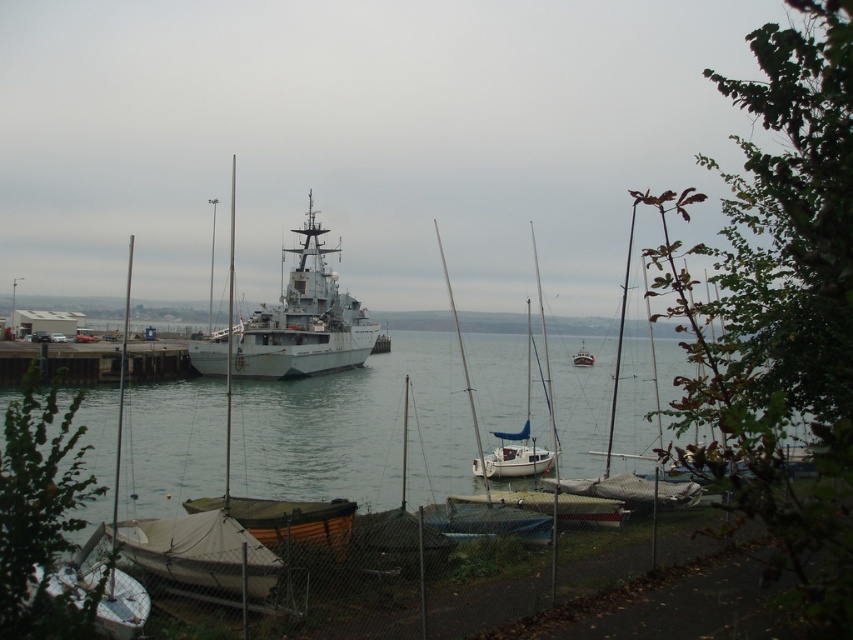
You are a harbor worker who needs to move a 100 meter long cargo ship into the harbor. The white canvas boat at lower left and the white matte sailboat at center are in the way. Can you move the cargo ship through the space between them?

The white canvas boat at lower left and white matte sailboat at center are 133.41 meters apart from each other. Since the cargo ship is 100 meters long, the space between them is sufficient for the ship to pass through.

You are a photographer positioned at the dock. You want to take a photo of the white canvas boat at lower left without the white matte ship at center blocking the view. Is this possible given their positions?

The white canvas boat at lower left is behind the white matte ship at center, so it is currently blocked by the ship. To take a photo without the ship blocking the view, you would need to reposition yourself or move the boat.